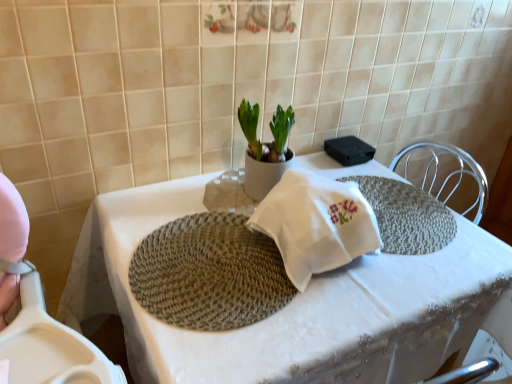
Question: In terms of size, does white ceramic pot at center appear bigger or smaller than rattan placemat at center?

Choices:
 (A) small
 (B) big

Answer: (B)

Question: From the image's perspective, relative to rattan placemat at center, is white ceramic pot at center above or below?

Choices:
 (A) below
 (B) above

Answer: (B)

Question: Based on their relative distances, which object is farther from the rattan placemat at center?

Choices:
 (A) white woven placemat at center
 (B) white ceramic pot at center

Answer: (B)

Question: Which of these objects is positioned closest to the white ceramic pot at center?

Choices:
 (A) rattan placemat at center
 (B) white woven placemat at center

Answer: (A)